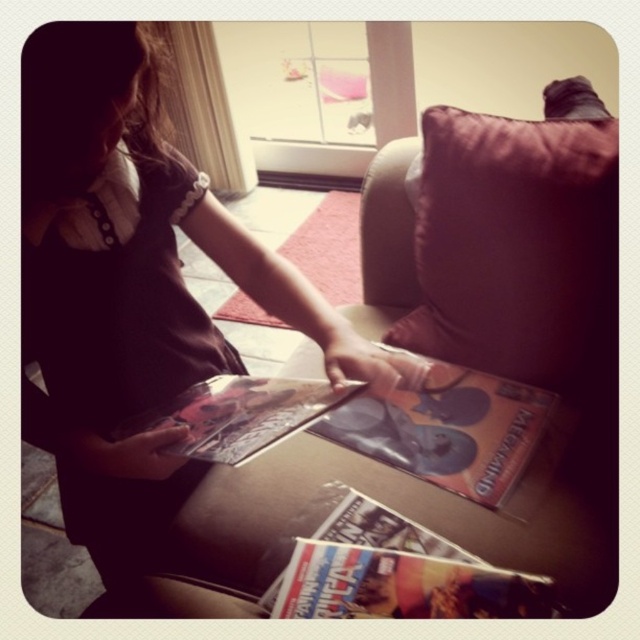
You are trying to reach a remote control placed at point [451,451] on the sofa. If your hand can extend 40 inches, can you reach it?

The distance between your hand and the remote control at point [451,451] is 39.03 inches, which is within your hand extension range of 40 inches. Yes, you can reach it.

You are a delivery robot that needs to place a small package on the matte cardboard magazine at center. The package is 36.69 inches long. Can you safely place it there without it hanging off the edge?

The matte cardboard magazine at center is 36.69 inches from camera, so the package of the same length can be placed there safely as it matches the distance required.